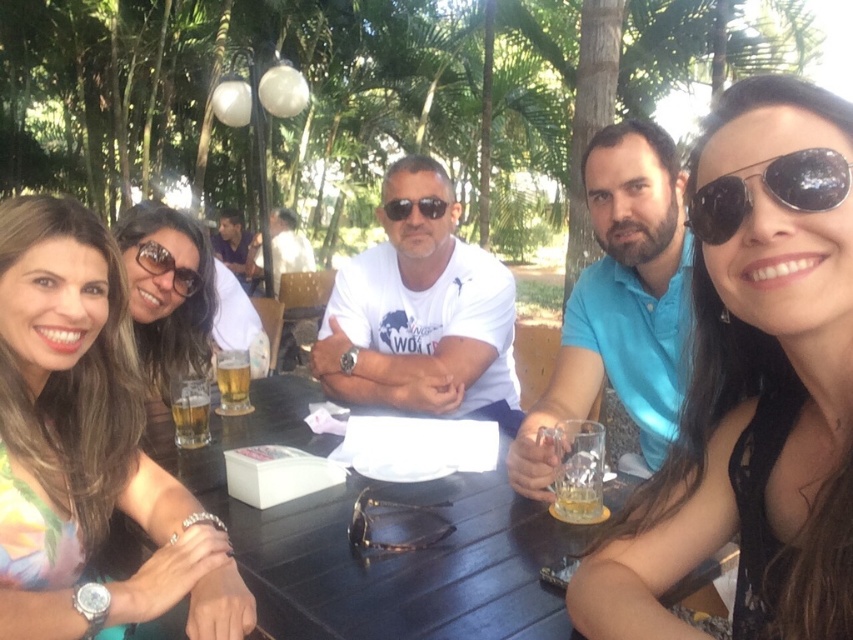
Is blue satin polo shirt at center above matte black sunglasses at upper left?

No.

Is blue satin polo shirt at center further to the viewer compared to matte black sunglasses at upper left?

No, it is in front of matte black sunglasses at upper left.

Does point (642, 417) come in front of point (194, 330)?

That is True.

Identify the location of blue satin polo shirt at center. The width and height of the screenshot is (853, 640). (621, 304).

Can you confirm if floral fabric dress at lower left is smaller than white t-shirt at center?

Indeed, floral fabric dress at lower left has a smaller size compared to white t-shirt at center.

Looking at this image, who is more forward, (144,579) or (279,282)?

Point (144,579) is in front.

What do you see at coordinates (91, 433) in the screenshot? I see `floral fabric dress at lower left` at bounding box center [91, 433].

This screenshot has width=853, height=640. I want to click on floral fabric dress at lower left, so click(x=91, y=433).

Does point (67, 369) lie behind point (190, 442)?

No, it is in front of (190, 442).

Is floral fabric dress at lower left smaller than translucent glass beer at table center?

No, floral fabric dress at lower left is not smaller than translucent glass beer at table center.

Who is more forward, (73, 368) or (177, 416)?

Point (73, 368) is more forward.

You are a GUI agent. You are given a task and a screenshot of the screen. Output one action in this format:
    pyautogui.click(x=<x>, y=<y>)
    Task: Click on the floral fabric dress at lower left
    This screenshot has height=640, width=853.
    Given the screenshot: What is the action you would take?
    pyautogui.click(x=91, y=433)